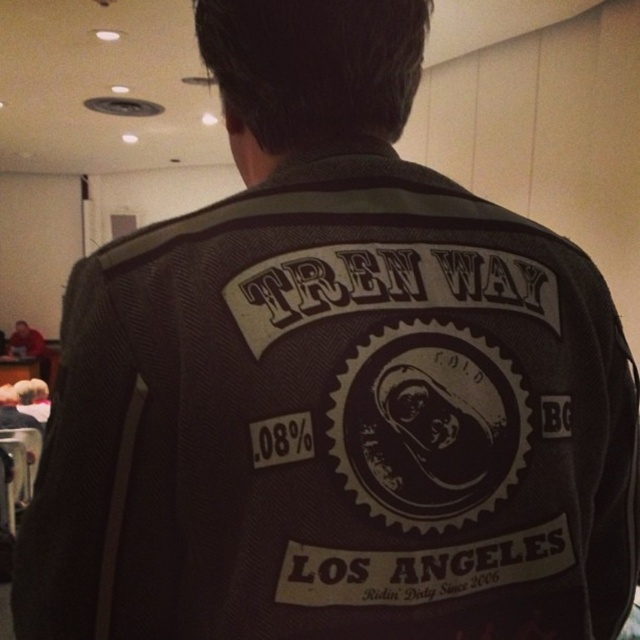
Who is lower down, black matte patch at center or red leather jacket at lower left?

red leather jacket at lower left is below.

Is black matte patch at center positioned before red leather jacket at lower left?

Yes.

Is point (401, 472) positioned before point (20, 348)?

Yes.

You are a GUI agent. You are given a task and a screenshot of the screen. Output one action in this format:
    pyautogui.click(x=<x>, y=<y>)
    Task: Click on the black matte patch at center
    This screenshot has height=640, width=640.
    Given the screenshot: What is the action you would take?
    pyautogui.click(x=428, y=426)